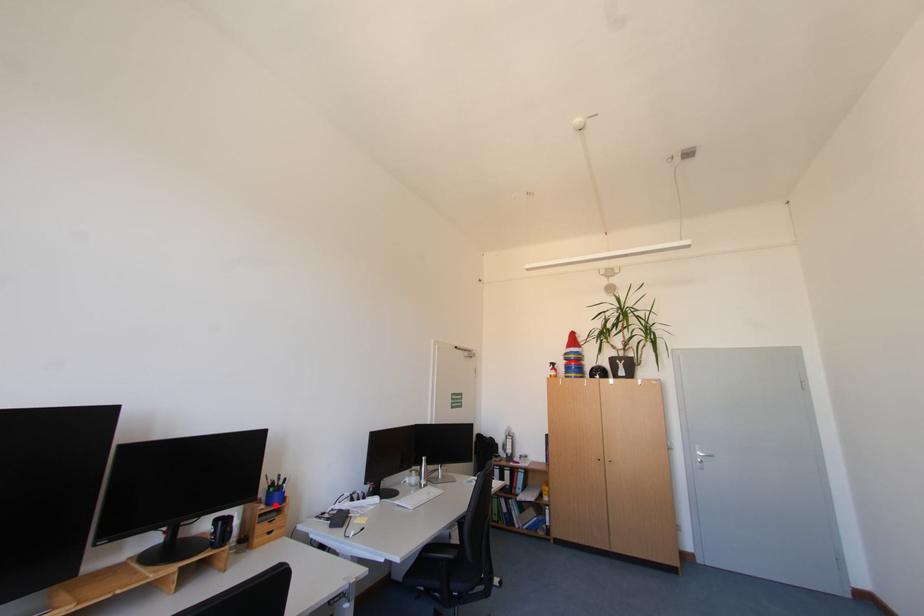
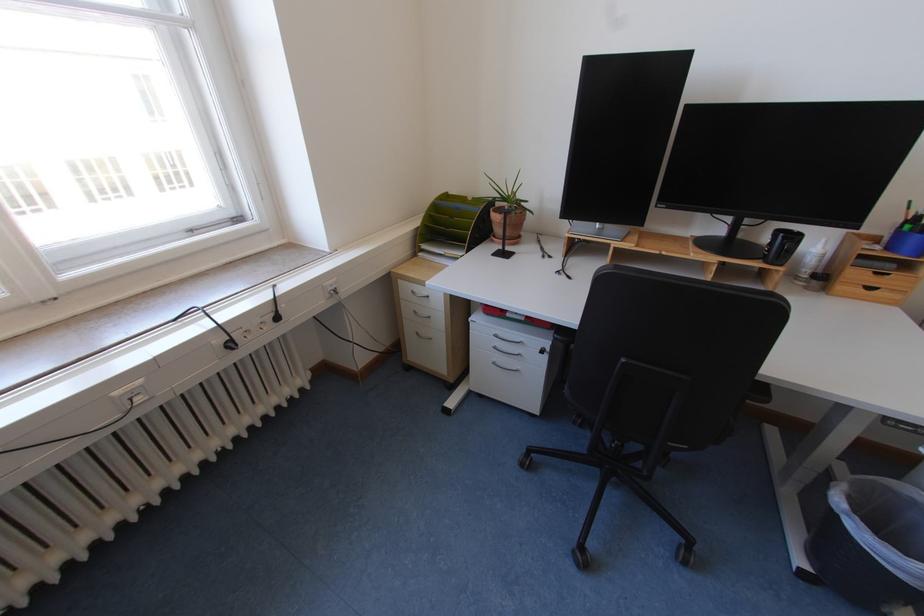
Question: I am providing you with two images of the same scene from different viewpoints. Image1 has a red point marked. In image2, the corresponding 3D location appears at what relative position? Reply with the corresponding letter.

Choices:
 (A) Closer
 (B) Farther

Answer: (B)